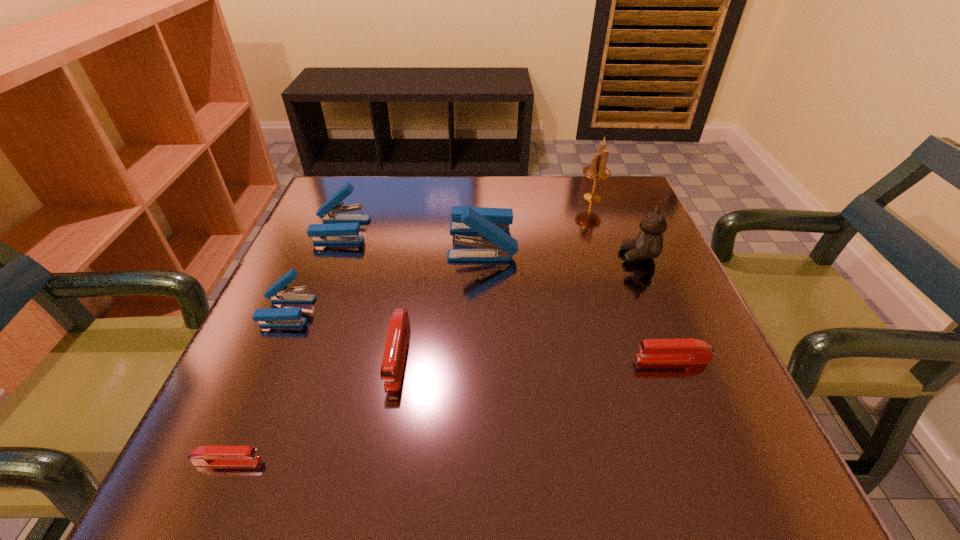
The width and height of the screenshot is (960, 540). I want to click on vacant space situated on the right of the fourth tallest object, so click(540, 230).

Identify the location of free space located on the right of the nearest blue stapler. The width and height of the screenshot is (960, 540). (337, 311).

Image resolution: width=960 pixels, height=540 pixels. What are the coordinates of `vacant space located 0.080m on the front-facing side of the third stapler from right to left` in the screenshot? It's located at (383, 438).

The width and height of the screenshot is (960, 540). What are the coordinates of `vacant space located on the front-facing side of the rightmost stapler` in the screenshot? It's located at (548, 359).

You are a GUI agent. You are given a task and a screenshot of the screen. Output one action in this format:
    pyautogui.click(x=<x>, y=<y>)
    Task: Click on the vacant position located 0.150m on the front-facing side of the rightmost stapler
    This screenshot has height=540, width=960.
    Given the screenshot: What is the action you would take?
    pyautogui.click(x=548, y=359)

Find the location of a particular element. The image size is (960, 540). vacant space situated on the front-facing side of the rightmost stapler is located at coordinates (447, 359).

The width and height of the screenshot is (960, 540). In order to click on free space located 0.200m on the front-facing side of the nearest object in this screenshot , I will do `click(403, 461)`.

The image size is (960, 540). I want to click on candle holder located at the far edge, so click(x=597, y=170).

This screenshot has height=540, width=960. Identify the location of object positioned at the near edge. (212, 456).

Where is `candle holder at the right edge`? candle holder at the right edge is located at coordinates (597, 170).